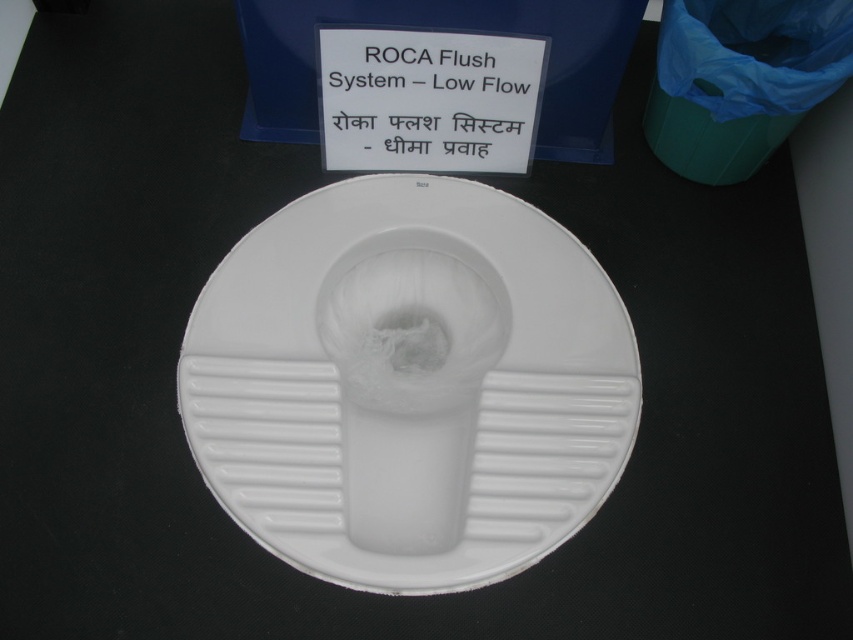
Question: Does white matte toilet at center have a greater width compared to white plastic sign at upper center?

Choices:
 (A) yes
 (B) no

Answer: (A)

Question: Does white matte toilet at center come behind white plastic sign at upper center?

Choices:
 (A) no
 (B) yes

Answer: (A)

Question: Among these objects, which one is farthest from the camera?

Choices:
 (A) white matte toilet at center
 (B) white plastic sign at upper center

Answer: (B)

Question: Which point is closer to the camera taking this photo?

Choices:
 (A) (395, 570)
 (B) (387, 49)

Answer: (A)

Question: Can you confirm if white matte toilet at center is positioned below white plastic sign at upper center?

Choices:
 (A) no
 (B) yes

Answer: (B)